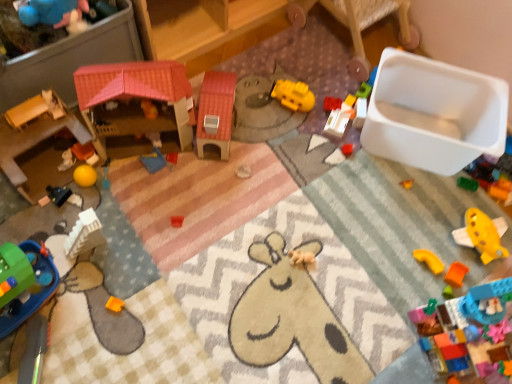
Identify the location of vacant space that's between yellow matte plastic arch at lower right, acting as the 4th toy starting from the right, and blue plastic tray at center, acting as the 6th toy starting from the left. (289, 216).